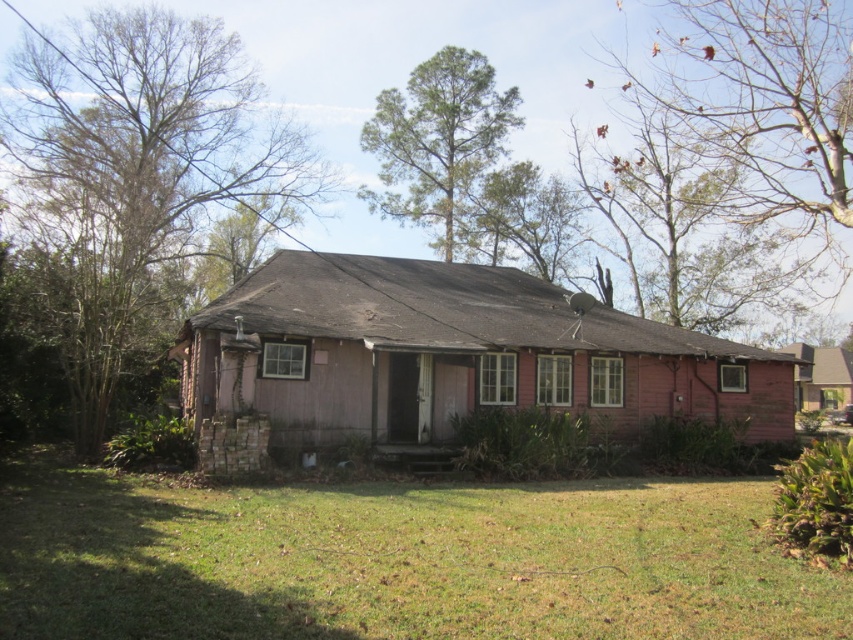
You are a painter standing on the ground and want to paint the house. You notice the bare branches at left and the brown leafy tree at upper right. Which one might block your view of the house more when you look from the front?

The bare branches at left might block your view of the house more because their width is larger than the brown leafy tree at upper right.

You are a gardener who wants to plant a new flower bed between the green grass at lower center and the brown leafy tree at upper right. Based on their heights, which area would be more suitable for taller plants?

The area near the brown leafy tree at upper right is more suitable for taller plants since the green grass at lower center has a lesser height compared to the brown leafy tree at upper right, indicating that the tree area can accommodate taller vegetation.